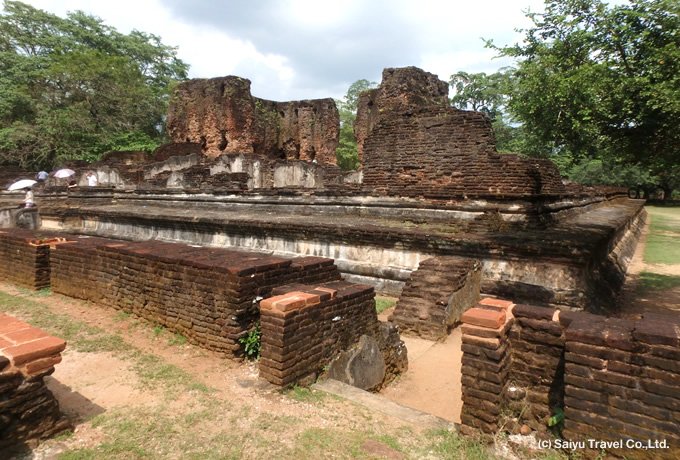
Identify the location of aged brick. (578, 331).